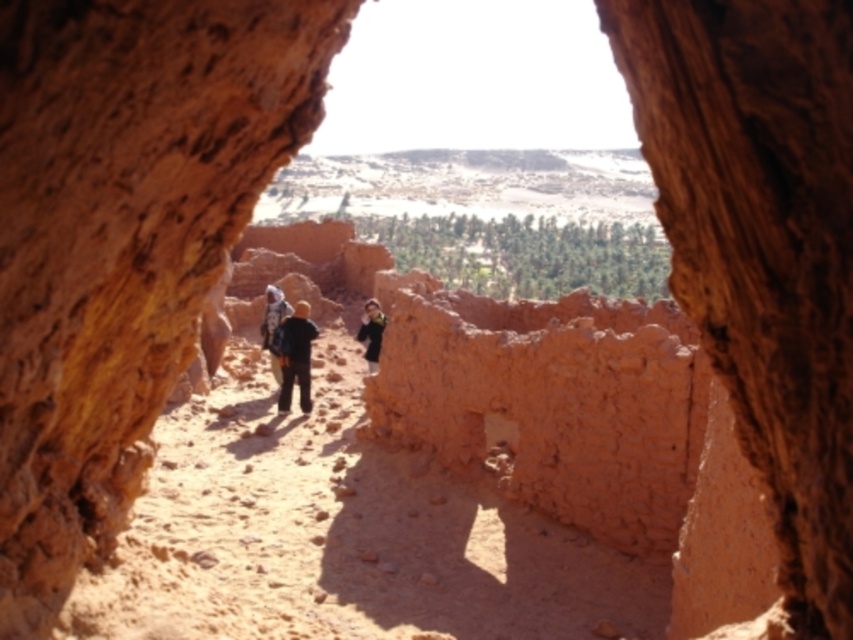
Consider the image. Between matte brown backpack at center and dark green fabric jacket at center, which one appears on the left side from the viewer's perspective?

Positioned to the left is matte brown backpack at center.

Who is higher up, matte brown backpack at center or dark green fabric jacket at center?

matte brown backpack at center is higher up.

Between point (267, 298) and point (376, 308), which one is positioned behind?

The point (267, 298) is more distant.

You are a GUI agent. You are given a task and a screenshot of the screen. Output one action in this format:
    pyautogui.click(x=<x>, y=<y>)
    Task: Click on the matte brown backpack at center
    Image resolution: width=853 pixels, height=640 pixels.
    Given the screenshot: What is the action you would take?
    pyautogui.click(x=273, y=324)

Can you confirm if dark brown leather jacket at center is thinner than matte brown backpack at center?

Indeed, dark brown leather jacket at center has a lesser width compared to matte brown backpack at center.

Can you confirm if dark brown leather jacket at center is positioned to the right of matte brown backpack at center?

Yes, dark brown leather jacket at center is to the right of matte brown backpack at center.

Between point (309, 353) and point (271, 346), which one is positioned in front?

Positioned in front is point (309, 353).

Find the location of a particular element. The image size is (853, 640). dark brown leather jacket at center is located at coordinates (294, 355).

Between dark brown leather jacket at center and dark green fabric jacket at center, which one appears on the left side from the viewer's perspective?

From the viewer's perspective, dark brown leather jacket at center appears more on the left side.

Is dark brown leather jacket at center positioned at the back of dark green fabric jacket at center?

That is False.

Is point (300, 307) positioned before point (379, 324)?

Yes.

Locate an element on the screen. This screenshot has height=640, width=853. dark brown leather jacket at center is located at coordinates (294, 355).